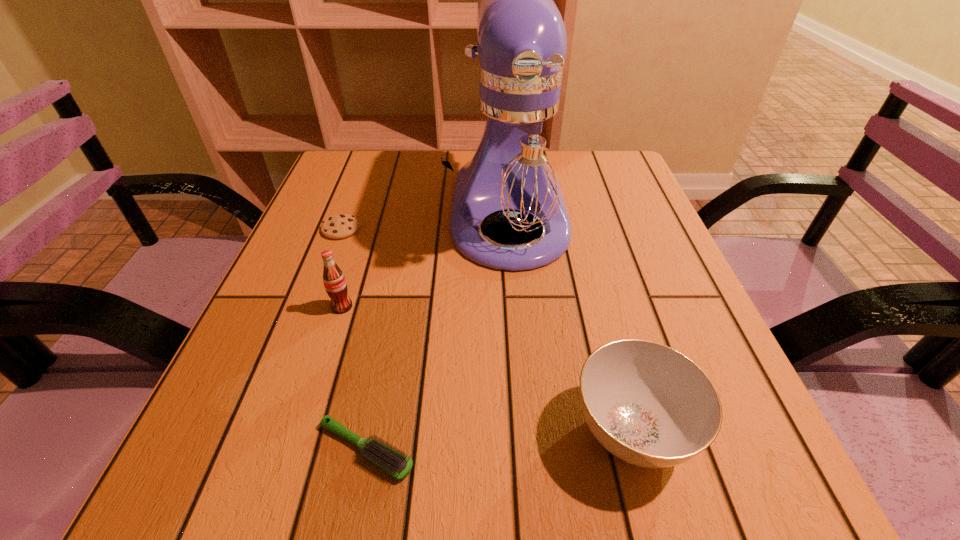
You are a GUI agent. You are given a task and a screenshot of the screen. Output one action in this format:
    pyautogui.click(x=<x>, y=<y>)
    Task: Click on the vacant space positioned on the right of the hairbrush
    
    Given the screenshot: What is the action you would take?
    pyautogui.click(x=533, y=449)

The width and height of the screenshot is (960, 540). Identify the location of object located in the far edge section of the desktop. (515, 162).

Locate an element on the screen. chinaware at the near edge is located at coordinates (649, 405).

Image resolution: width=960 pixels, height=540 pixels. Find the location of `hairbrush situated at the near edge`. hairbrush situated at the near edge is located at coordinates (393, 462).

Image resolution: width=960 pixels, height=540 pixels. I want to click on soda that is at the left edge, so click(x=335, y=284).

You are a GUI agent. You are given a task and a screenshot of the screen. Output one action in this format:
    pyautogui.click(x=<x>, y=<y>)
    Task: Click on the cookie that is positioned at the left edge
    The image size is (960, 540).
    Given the screenshot: What is the action you would take?
    pyautogui.click(x=339, y=226)

Where is `object that is at the right edge`? This screenshot has height=540, width=960. object that is at the right edge is located at coordinates (649, 405).

Image resolution: width=960 pixels, height=540 pixels. I want to click on object that is positioned at the near right corner, so click(x=649, y=405).

This screenshot has width=960, height=540. In order to click on vacant space at the far edge of the desktop in this screenshot , I will do `click(403, 184)`.

You are a GUI agent. You are given a task and a screenshot of the screen. Output one action in this format:
    pyautogui.click(x=<x>, y=<y>)
    Task: Click on the vacant space at the left edge
    The image size is (960, 540).
    Given the screenshot: What is the action you would take?
    pyautogui.click(x=304, y=220)